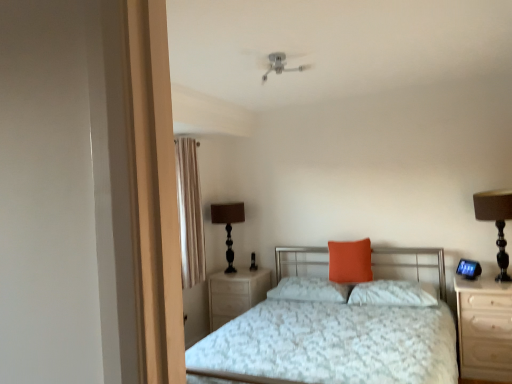
Question: Is beige fabric curtain at left turned away from orange fabric pillow at center, marked as the 3th pillow in a left-to-right arrangement?

Choices:
 (A) no
 (B) yes

Answer: (A)

Question: Is beige fabric curtain at left wider than orange fabric pillow at center, acting as the 1th pillow starting from the right?

Choices:
 (A) no
 (B) yes

Answer: (A)

Question: Does beige fabric curtain at left have a lesser height compared to orange fabric pillow at center, acting as the 1th pillow starting from the right?

Choices:
 (A) no
 (B) yes

Answer: (A)

Question: From the image's perspective, is beige fabric curtain at left above orange fabric pillow at center, acting as the 1th pillow starting from the right?

Choices:
 (A) no
 (B) yes

Answer: (B)

Question: From a real-world perspective, is beige fabric curtain at left positioned over orange fabric pillow at center, marked as the 3th pillow in a left-to-right arrangement, based on gravity?

Choices:
 (A) yes
 (B) no

Answer: (A)

Question: From the image's perspective, relative to light wood/wooden nightstand at center, positioned as the 1th nightstand in back-to-front order, is orange fabric pillow at center, the 2th pillow when ordered from right to left, above or below?

Choices:
 (A) below
 (B) above

Answer: (B)

Question: From a real-world perspective, is orange fabric pillow at center, the 2th pillow when ordered from right to left, above or below light wood/wooden nightstand at center, positioned as the 1th nightstand in back-to-front order?

Choices:
 (A) above
 (B) below

Answer: (A)

Question: Is point (350, 279) positioned closer to the camera than point (222, 283)?

Choices:
 (A) closer
 (B) farther

Answer: (A)

Question: In terms of width, does orange fabric pillow at center, the 2th pillow when ordered from right to left, look wider or thinner when compared to light wood/wooden nightstand at center, placed as the 2th nightstand when sorted from right to left?

Choices:
 (A) wide
 (B) thin

Answer: (B)

Question: From the image's perspective, is orange fabric pillow at center, the 2th pillow when ordered from right to left, positioned above or below brown fabric table lamp at right, placed as the first table lamp when sorted from right to left?

Choices:
 (A) above
 (B) below

Answer: (B)

Question: Considering the relative positions of orange fabric pillow at center, the 2th pillow when ordered from right to left, and brown fabric table lamp at right, the first table lamp in the front-to-back sequence, in the image provided, is orange fabric pillow at center, the 2th pillow when ordered from right to left, to the left or to the right of brown fabric table lamp at right, the first table lamp in the front-to-back sequence,?

Choices:
 (A) right
 (B) left

Answer: (B)

Question: Is point (335, 256) closer or farther from the camera than point (478, 198)?

Choices:
 (A) farther
 (B) closer

Answer: (A)

Question: From a real-world perspective, is orange fabric pillow at center, which is the 2th pillow from left to right, positioned above or below brown fabric table lamp at right, the second table lamp when ordered from left to right?

Choices:
 (A) above
 (B) below

Answer: (B)

Question: From a real-world perspective, relative to light wood/wooden nightstand at center, placed as the 2th nightstand when sorted from right to left, is black glass table lamp at center left, the first table lamp from the back, vertically above or below?

Choices:
 (A) below
 (B) above

Answer: (B)

Question: From their relative heights in the image, would you say black glass table lamp at center left, which is the first table lamp in left-to-right order, is taller or shorter than light wood/wooden nightstand at center, positioned as the 1th nightstand in back-to-front order?

Choices:
 (A) short
 (B) tall

Answer: (B)